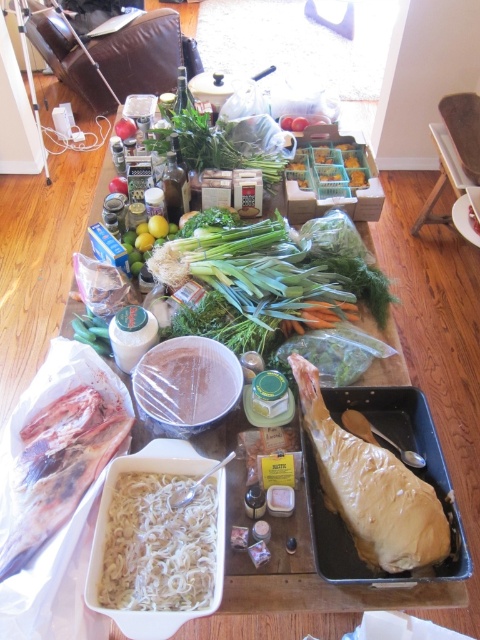
You are a chef preparing a meal and need to place a 25 inch long serving platter between the golden brown parchment paper wrapped meat at center and the green leafy at center on the table. Can the platter fit in the space between them?

The distance between the golden brown parchment paper wrapped meat at center and the green leafy at center is 27.48 inches. Since the serving platter is 25 inches long, it can fit in the space between them as there is enough room.

You are standing at the edge of the table in the kitchen scene. There are two points marked on the table surface. Which point is closer to you, point [311,403] or point [103,346]?

→ Point [311,403] is closer to the viewer than point [103,346].